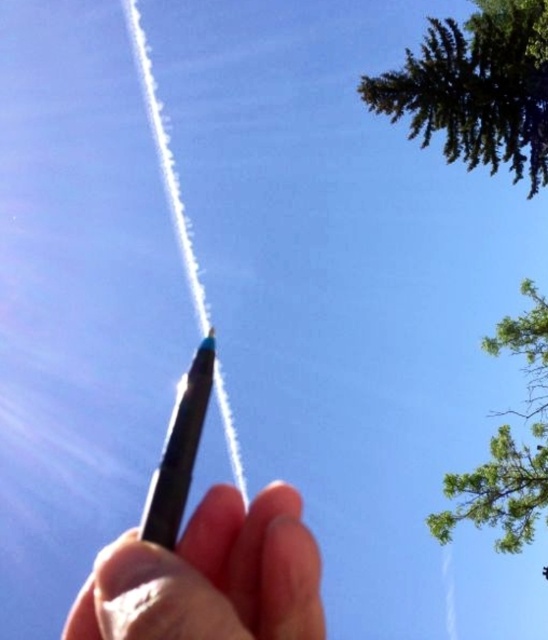
Question: Which point is farther from the camera taking this photo?

Choices:
 (A) (313, 538)
 (B) (523, 493)
 (C) (180, 388)

Answer: (B)

Question: Can you confirm if green leafy tree at upper right is wider than matte black pencil at center?

Choices:
 (A) no
 (B) yes

Answer: (B)

Question: Among these objects, which one is nearest to the camera?

Choices:
 (A) black matte pen at center
 (B) matte black pencil at center
 (C) green leafy tree at upper right

Answer: (A)

Question: Can you confirm if green leafy tree at upper right is wider than black matte pen at center?

Choices:
 (A) no
 (B) yes

Answer: (B)

Question: Can you confirm if black matte pen at center is thinner than matte black pencil at center?

Choices:
 (A) yes
 (B) no

Answer: (A)

Question: Which point is closer to the camera taking this photo?

Choices:
 (A) (448, 534)
 (B) (157, 468)
 (C) (213, 532)

Answer: (B)